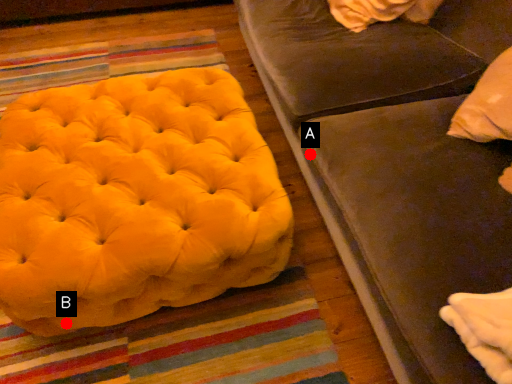
Question: Two points are circled on the image, labeled by A and B beside each circle. Which point appears closest to the camera in this image?

Choices:
 (A) A is closer
 (B) B is closer

Answer: (B)